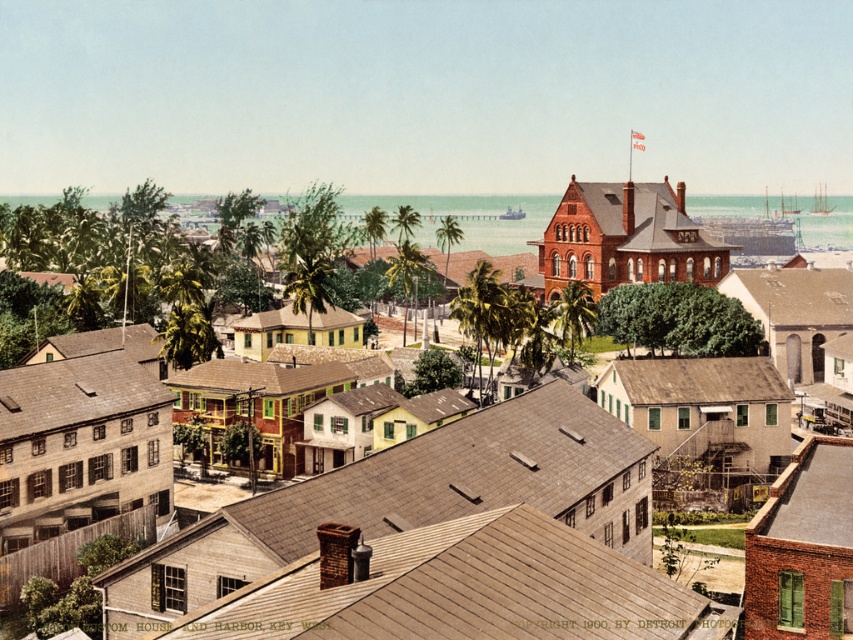
Which of these two, matte brown building at center or brown shingles at center, stands taller?

matte brown building at center

Does matte brown building at center have a lesser height compared to brown shingles at center?

Incorrect, matte brown building at center's height does not fall short of brown shingles at center's.

This screenshot has height=640, width=853. In order to click on matte brown building at center in this screenshot , I will do `click(383, 506)`.

The width and height of the screenshot is (853, 640). I want to click on matte brown building at center, so click(383, 506).